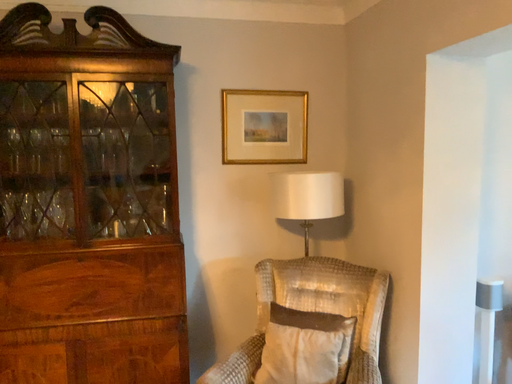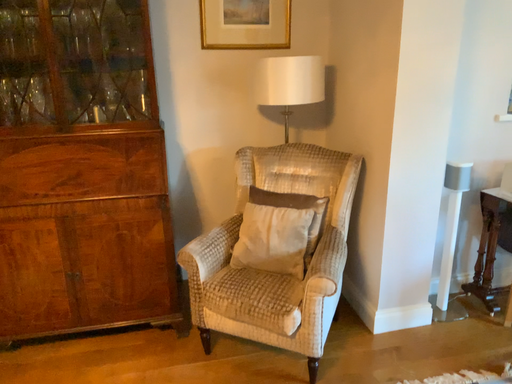
Question: How did the camera likely rotate when shooting the video?

Choices:
 (A) rotated downward
 (B) rotated upward

Answer: (A)